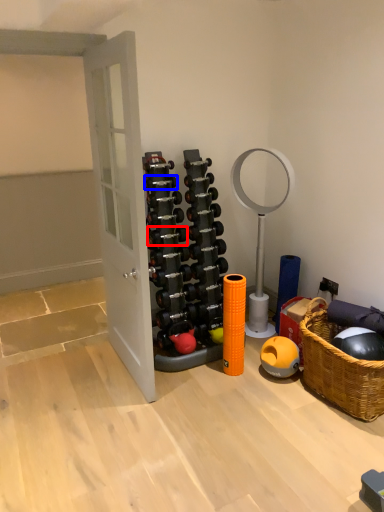
Question: Which object appears farthest to the camera in this image, dumbbell (highlighted by a red box) or dumbbell (highlighted by a blue box)?

Choices:
 (A) dumbbell
 (B) dumbbell

Answer: (A)